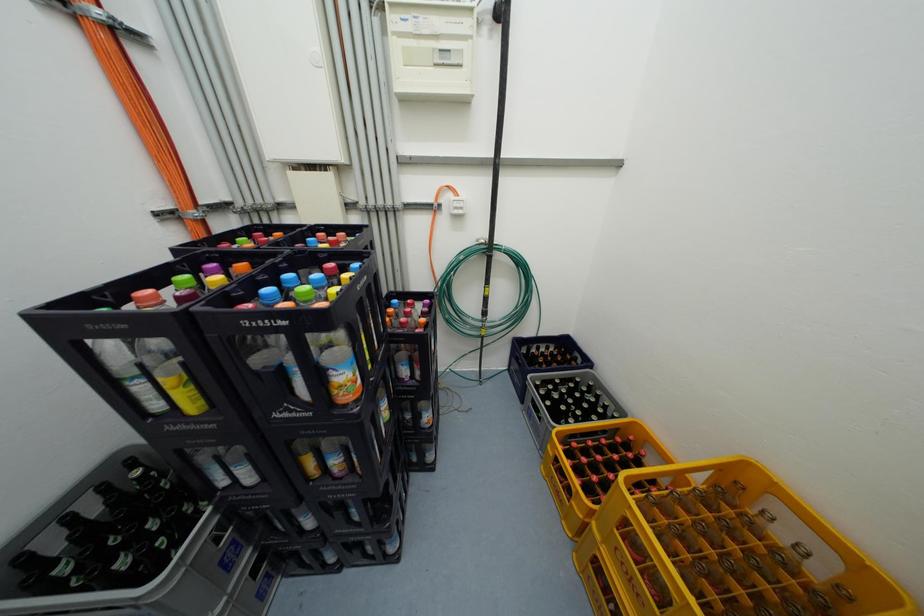
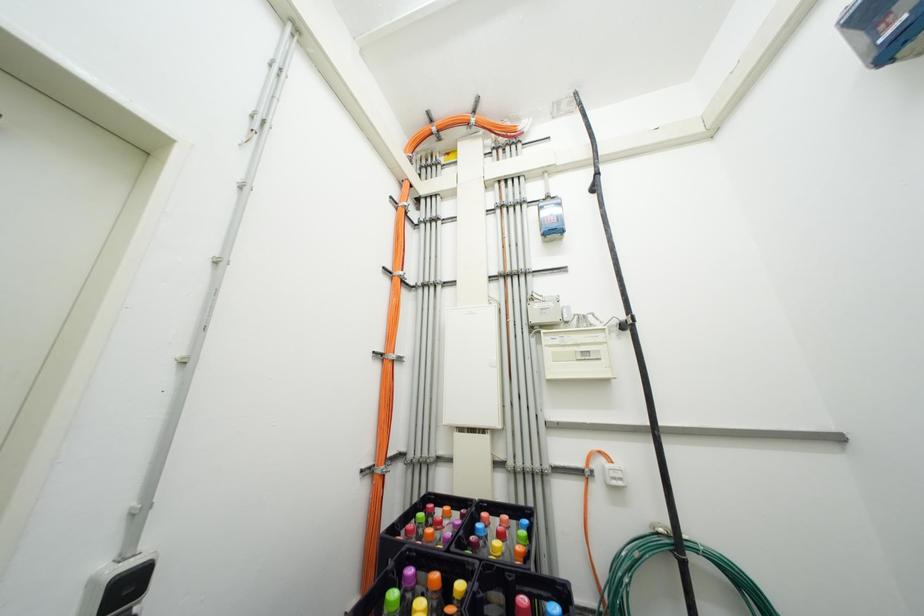
First-person continuous shooting, in which direction is the camera rotating?

The camera's rotation is toward left-up.